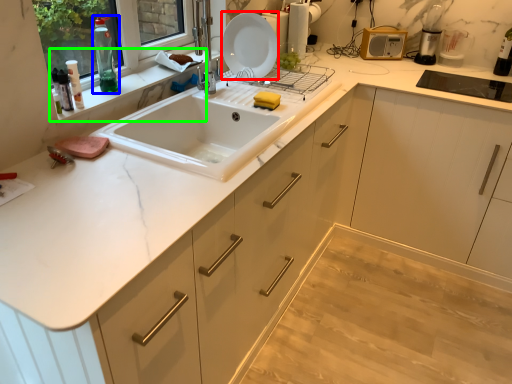
Question: Considering the real-world distances, which object is closest to plate (highlighted by a red box)? bottle (highlighted by a blue box) or window sill (highlighted by a green box).

Choices:
 (A) bottle
 (B) window sill

Answer: (B)